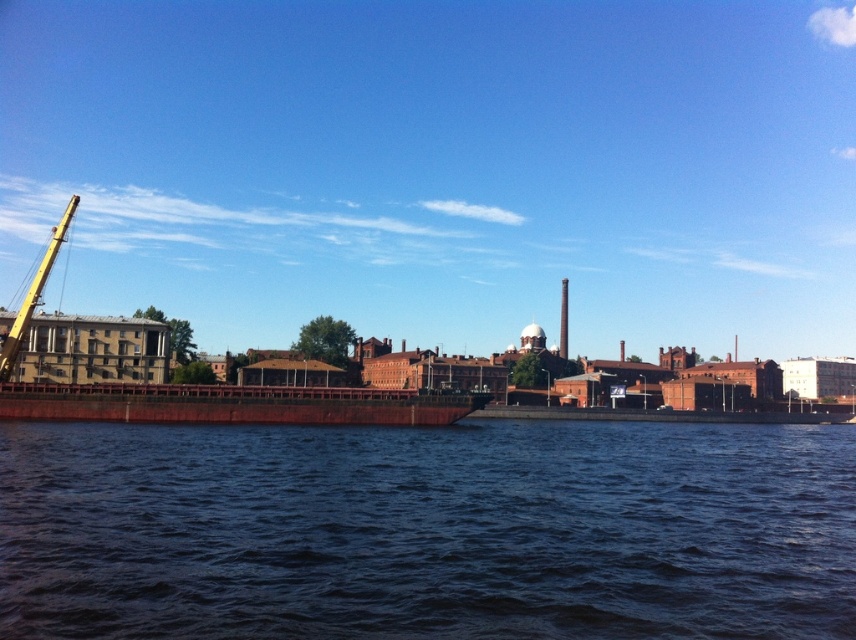
Question: Which object appears farthest from the camera in this image?

Choices:
 (A) dark blue water at center
 (B) rustic metal barge at center

Answer: (B)

Question: Is dark blue water at center positioned before yellow metallic crane at left?

Choices:
 (A) no
 (B) yes

Answer: (B)

Question: In this image, where is dark blue water at center located relative to rustic metal barge at center?

Choices:
 (A) above
 (B) below

Answer: (B)

Question: Which object is the closest to the yellow metallic crane at left?

Choices:
 (A) rustic metal barge at center
 (B) dark blue water at center

Answer: (A)

Question: Is dark blue water at center further to the viewer compared to rustic metal barge at center?

Choices:
 (A) no
 (B) yes

Answer: (A)

Question: Which of the following is the farthest from the observer?

Choices:
 (A) (12, 348)
 (B) (590, 580)
 (C) (113, 417)

Answer: (A)